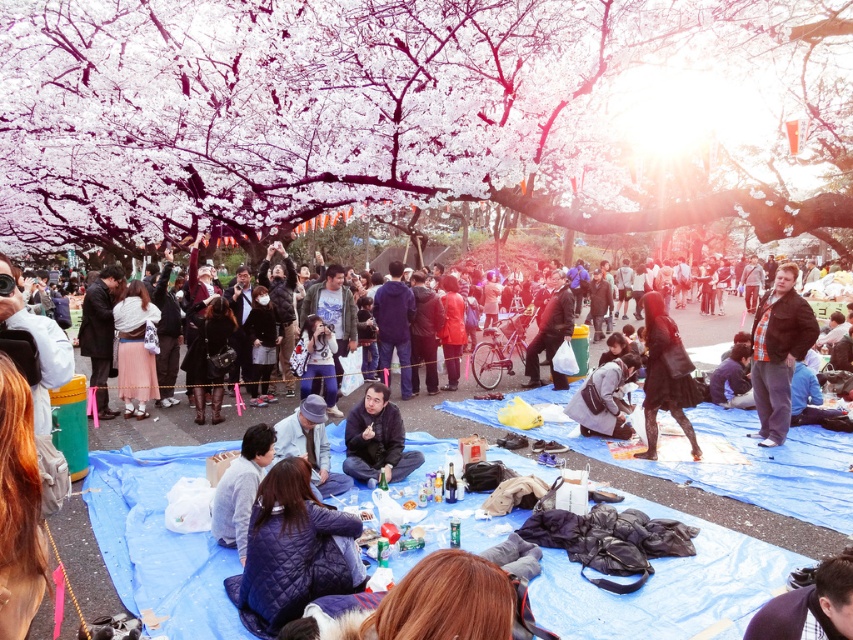
Does quilted blue jacket at center have a lesser height compared to dark brown leather jacket at center?

Correct, quilted blue jacket at center is not as tall as dark brown leather jacket at center.

Is the position of quilted blue jacket at center less distant than that of dark brown leather jacket at center?

Yes, quilted blue jacket at center is closer to the viewer.

Where is `quilted blue jacket at center`? The width and height of the screenshot is (853, 640). quilted blue jacket at center is located at coordinates (291, 550).

I want to click on quilted blue jacket at center, so click(x=291, y=550).

Looking at this image, between checkered shirt jacket at right and black matte dress at center, which one has more height?

checkered shirt jacket at right

Which is in front, point (775, 387) or point (640, 454)?

Point (640, 454)

At what (x,y) coordinates should I click in order to perform the action: click on checkered shirt jacket at right. Please return your answer as a coordinate pair (x, y). Looking at the image, I should click on click(778, 353).

Can you confirm if dark purple jacket at lower right is thinner than light gray sweater at lower center?

Yes.

Find the location of a particular element. dark purple jacket at lower right is located at coordinates (810, 605).